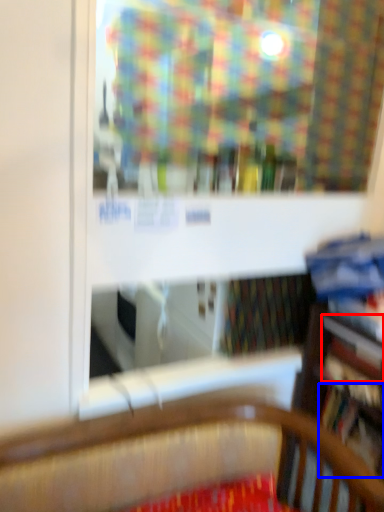
Question: Which object is closer to the camera taking this photo, book (highlighted by a red box) or book (highlighted by a blue box)?

Choices:
 (A) book
 (B) book

Answer: (A)